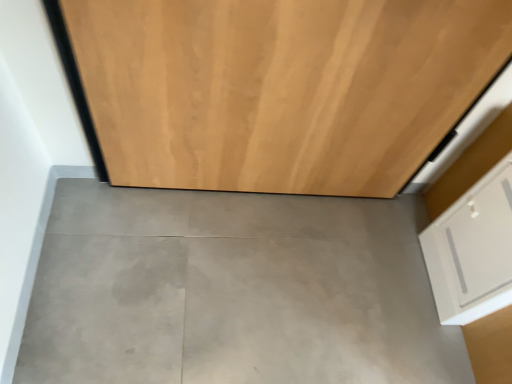
In order to click on vacant area that lies in front of wooden door at center in this screenshot , I will do `click(225, 281)`.